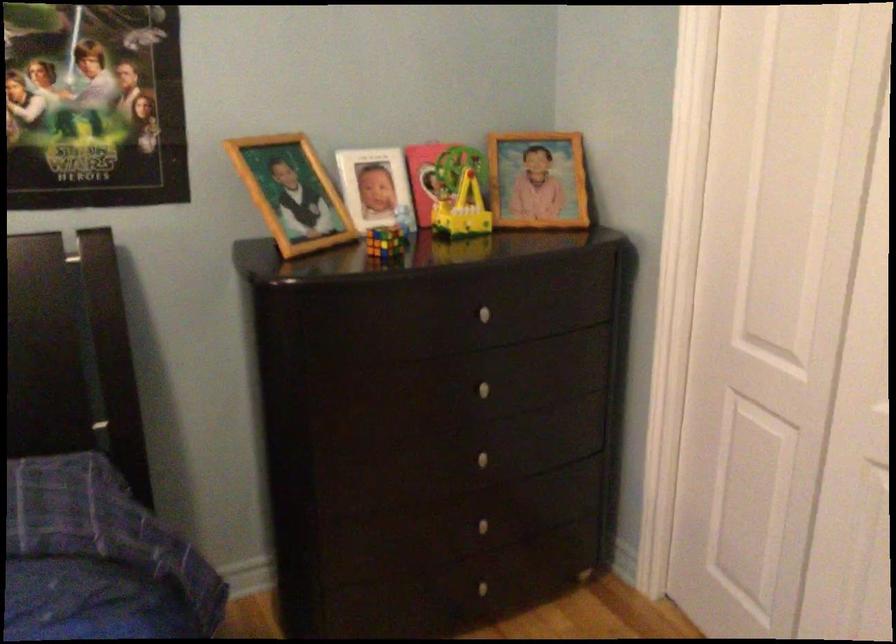
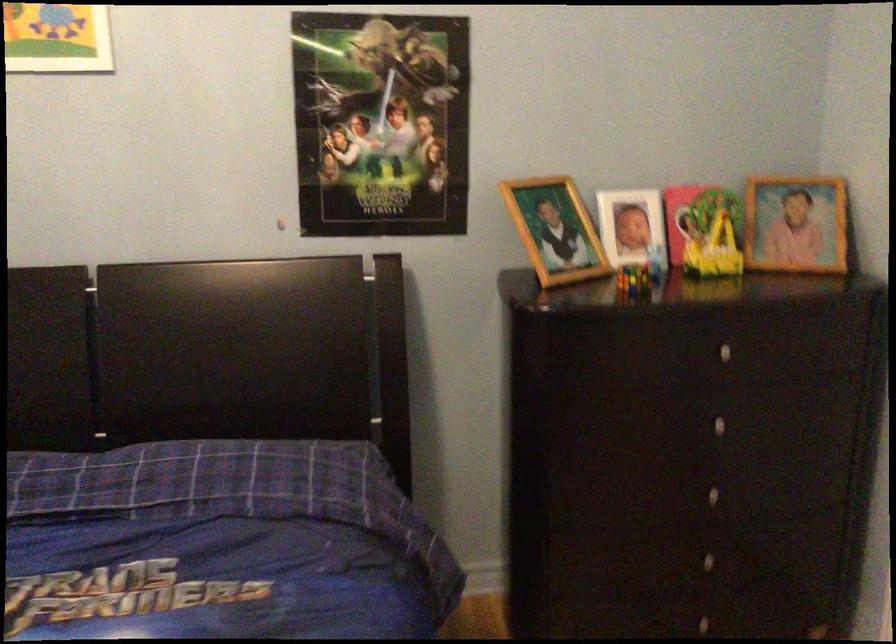
The point at (x=467, y=196) is marked in the first image. Where is the corresponding point in the second image?

(719, 240)